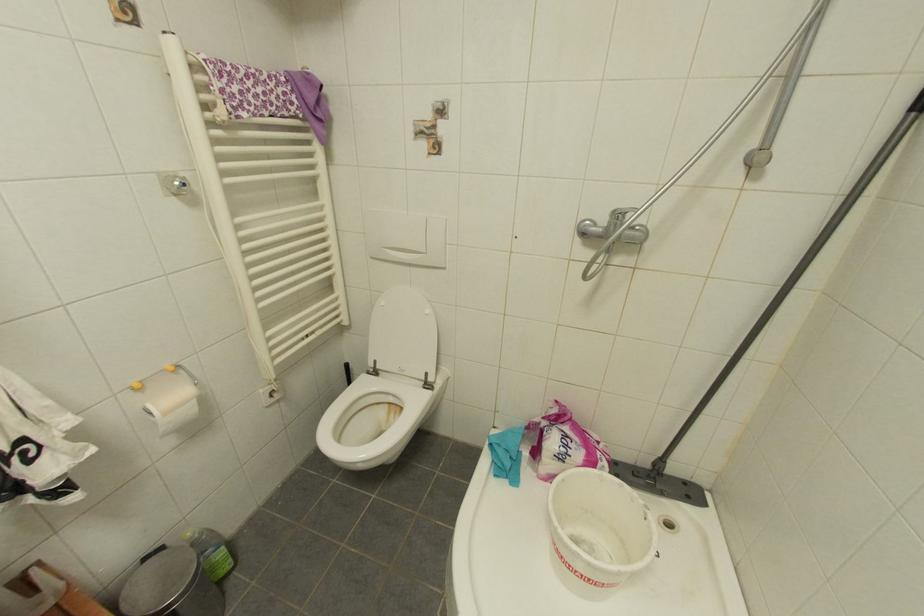
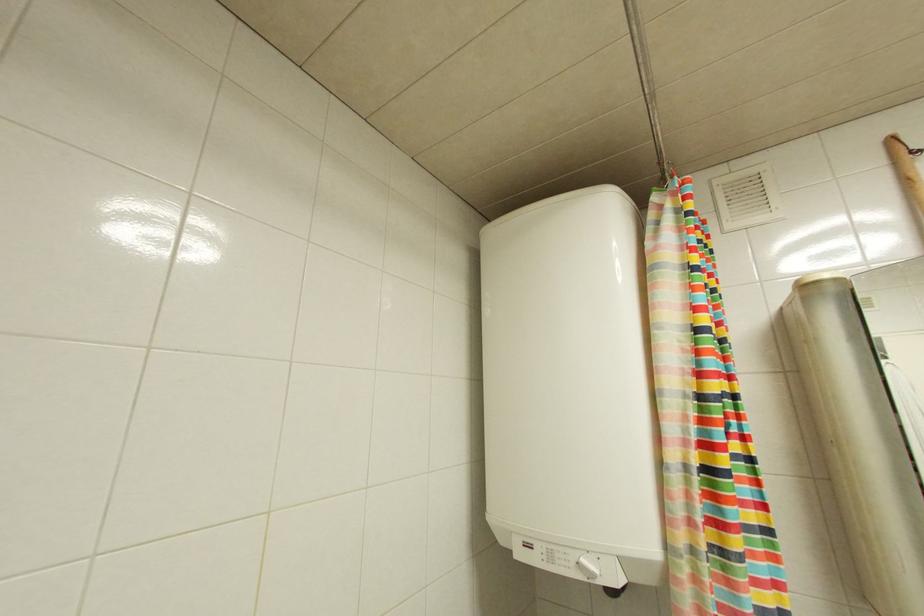
Question: The camera is either moving clockwise (left) or counter-clockwise (right) around the object. The first image is from the beginning of the video and the second image is from the end. Is the camera moving left or right when shooting the video?

Choices:
 (A) Left
 (B) Right

Answer: (B)